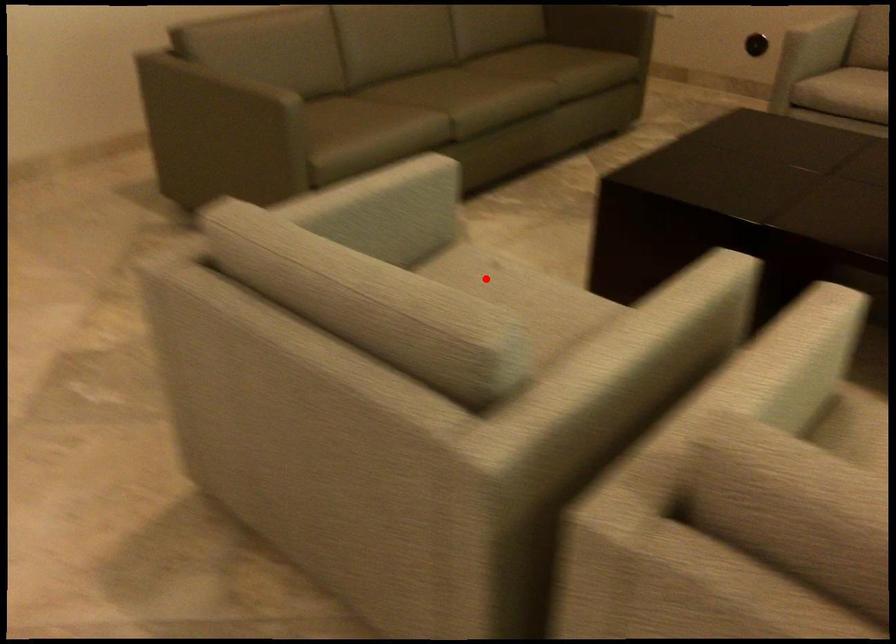
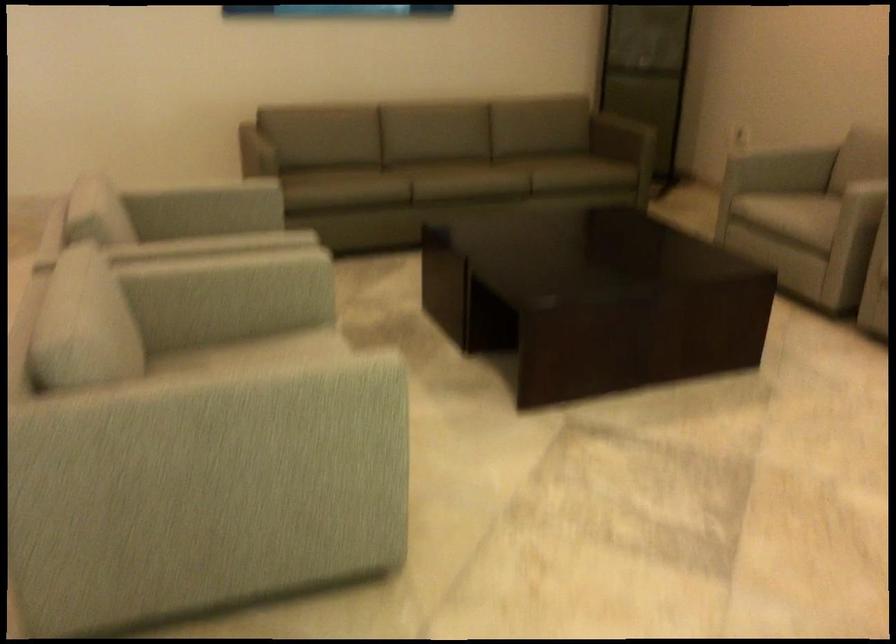
Question: I am providing you with two images of the same scene from different viewpoints. A red point is marked on the first image. At the location where the point appears in image 1, is it still visible in image 2?

Choices:
 (A) Yes
 (B) No

Answer: (B)